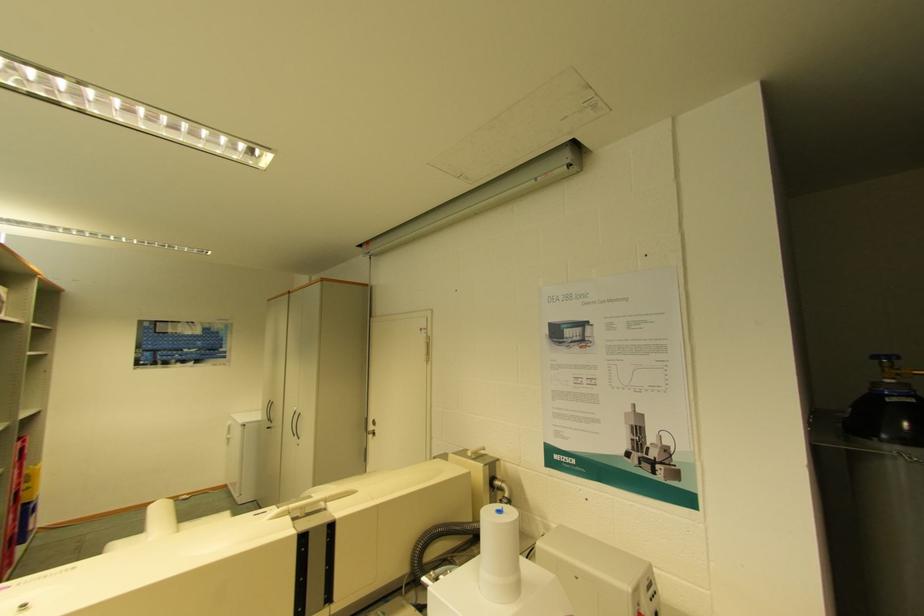
You are a GUI agent. You are given a task and a screenshot of the screen. Output one action in this format:
    pyautogui.click(x=<x>, y=<y>)
    Task: Click on the white appliance handle
    
    Given the screenshot: What is the action you would take?
    pyautogui.click(x=295, y=424)